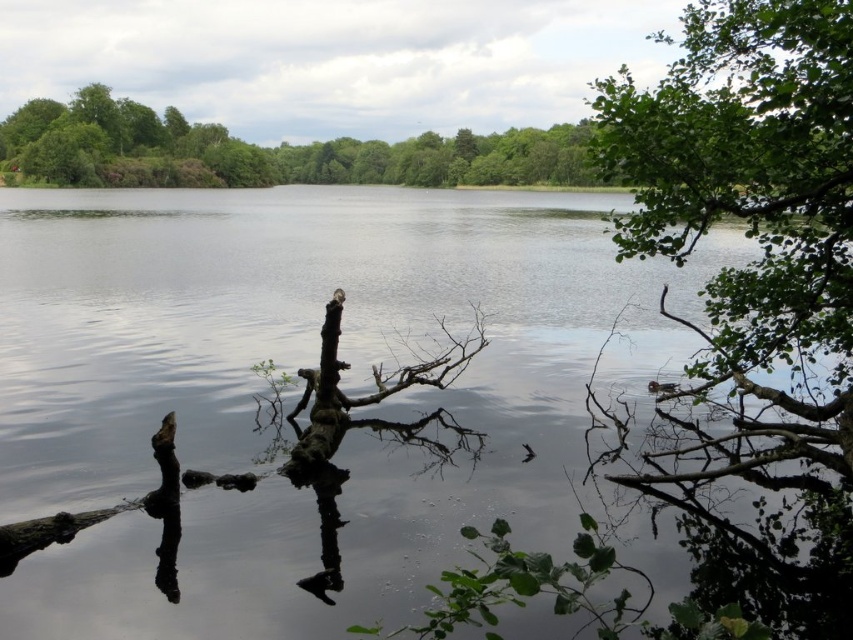
Question: Considering the relative positions of transparent water at center and brown rough branch at center in the image provided, where is transparent water at center located with respect to brown rough branch at center?

Choices:
 (A) left
 (B) right

Answer: (A)

Question: Which object is the farthest from the transparent water at center?

Choices:
 (A) brown rough branch at center
 (B) green leafy trees at upper center

Answer: (B)

Question: Which point is farther to the camera?

Choices:
 (A) transparent water at center
 (B) green leafy trees at upper center

Answer: (B)

Question: Can you confirm if transparent water at center is positioned below brown rough branch at center?

Choices:
 (A) no
 (B) yes

Answer: (A)

Question: Observing the image, what is the correct spatial positioning of transparent water at center in reference to green leafy trees at upper center?

Choices:
 (A) above
 (B) below

Answer: (B)

Question: Estimate the real-world distances between objects in this image. Which object is farther from the brown rough branch at center?

Choices:
 (A) green leafy trees at upper center
 (B) transparent water at center

Answer: (A)